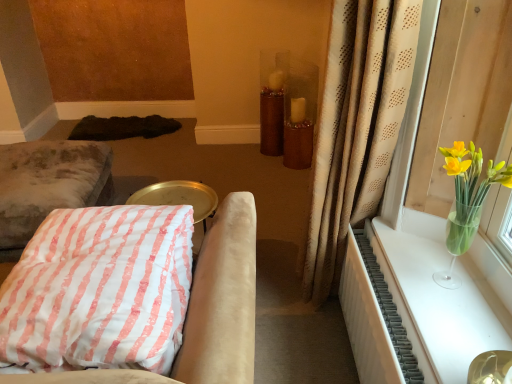
The image size is (512, 384). I want to click on vacant area situated below translucent glass vase at upper right (from a real-world perspective), so click(440, 279).